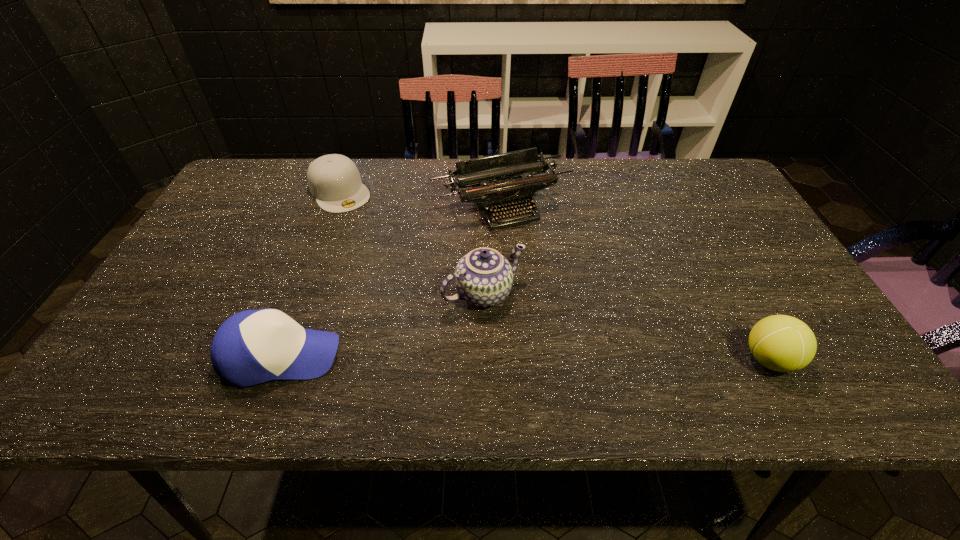
I want to click on vacant region located 0.390m on the front-facing side of the cap, so click(410, 296).

Locate an element on the screen. vacant position located 0.080m on the front-facing side of the cap is located at coordinates (361, 225).

Identify the location of vacant space located 0.260m on the front-facing side of the cap. This screenshot has width=960, height=540. (388, 264).

Find the location of `vacant area located 0.080m at the spout of the chinaware`. vacant area located 0.080m at the spout of the chinaware is located at coordinates (525, 337).

The width and height of the screenshot is (960, 540). I want to click on free space located 0.070m at the spout of the chinaware, so click(x=522, y=334).

Image resolution: width=960 pixels, height=540 pixels. I want to click on typewriter positioned at the far edge, so click(513, 185).

You are a GUI agent. You are given a task and a screenshot of the screen. Output one action in this format:
    pyautogui.click(x=<x>, y=<y>)
    Task: Click on the cap present at the far edge
    Image resolution: width=960 pixels, height=540 pixels.
    Given the screenshot: What is the action you would take?
    pyautogui.click(x=334, y=180)

The image size is (960, 540). I want to click on baseball cap located at the near edge, so click(x=251, y=347).

This screenshot has width=960, height=540. Find the location of `tennis ball at the near edge`. tennis ball at the near edge is located at coordinates (782, 343).

You are a GUI agent. You are given a task and a screenshot of the screen. Output one action in this format:
    pyautogui.click(x=<x>, y=<y>)
    Task: Click on the object positioned at the right edge
    The image size is (960, 540).
    Given the screenshot: What is the action you would take?
    pyautogui.click(x=782, y=343)